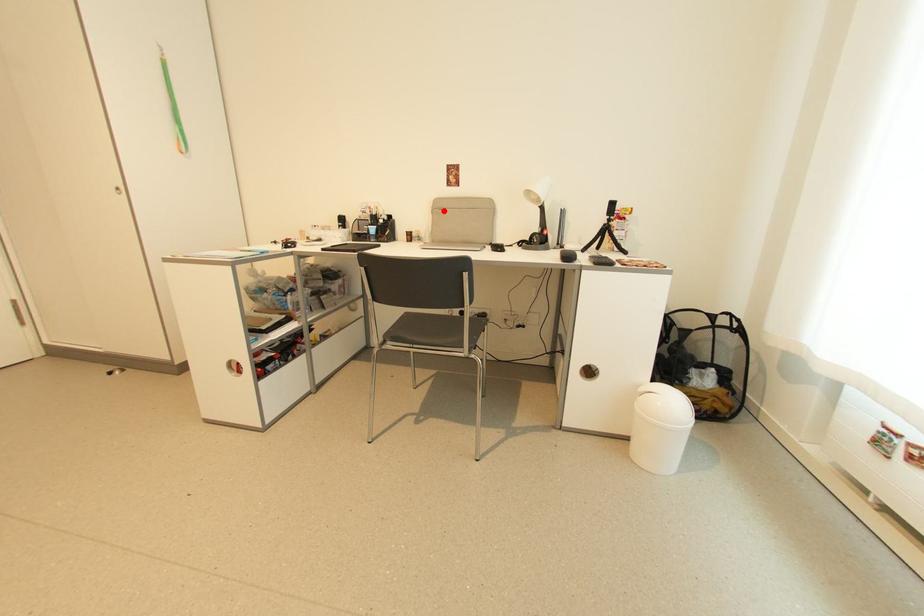
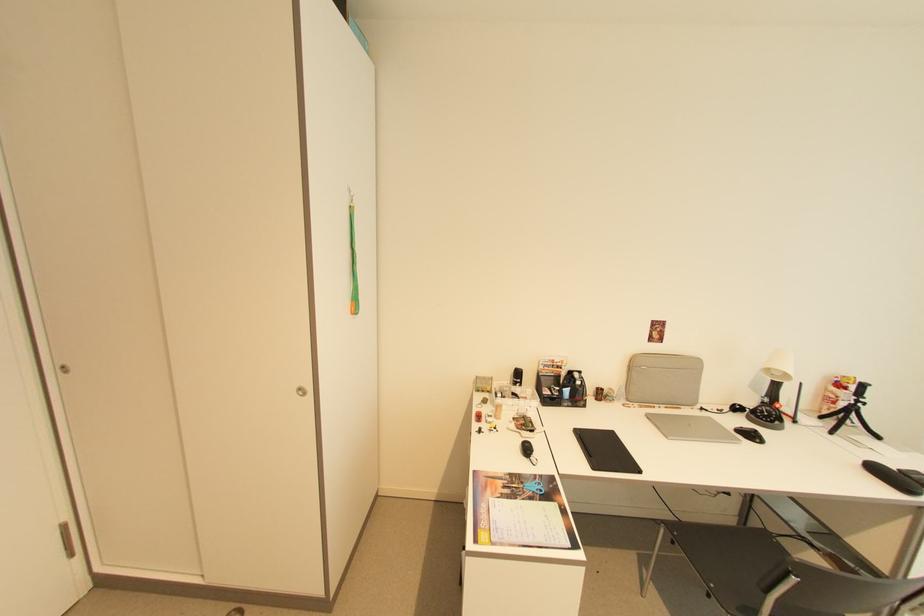
Question: I am providing you with two images of the same scene from different viewpoints. In image1, a red point is highlighted. Considering the same 3D point in image2, which of the following is correct?

Choices:
 (A) It is closer
 (B) It is farther

Answer: (B)